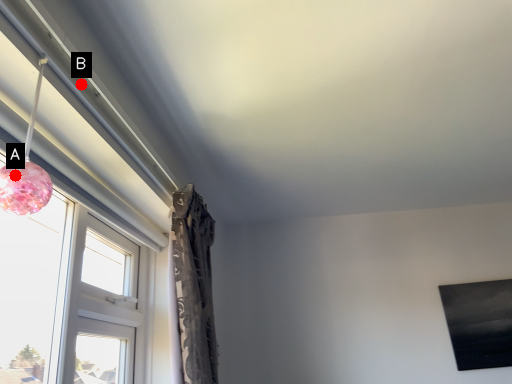
Question: Two points are circled on the image, labeled by A and B beside each circle. Which point is closer to the camera?

Choices:
 (A) A is closer
 (B) B is closer

Answer: (A)